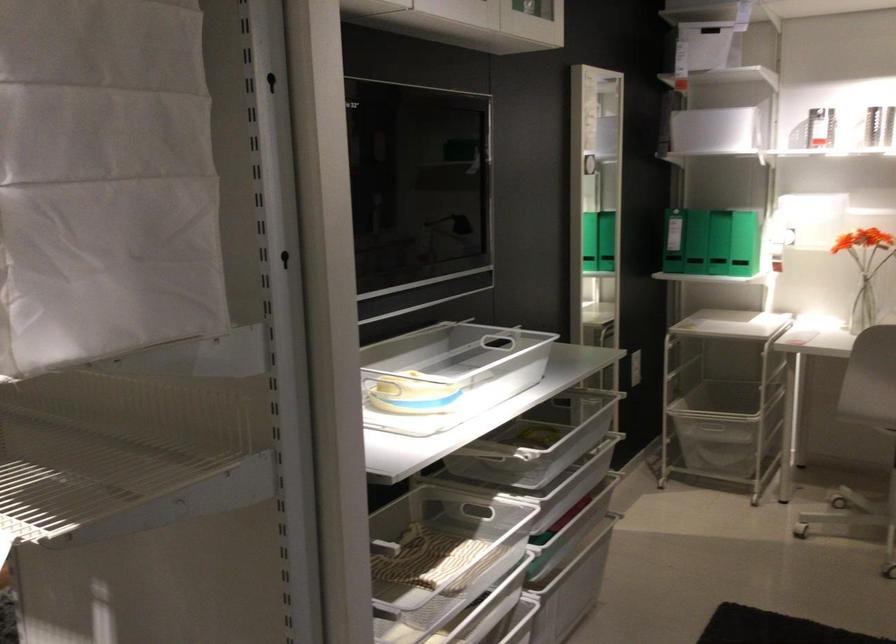
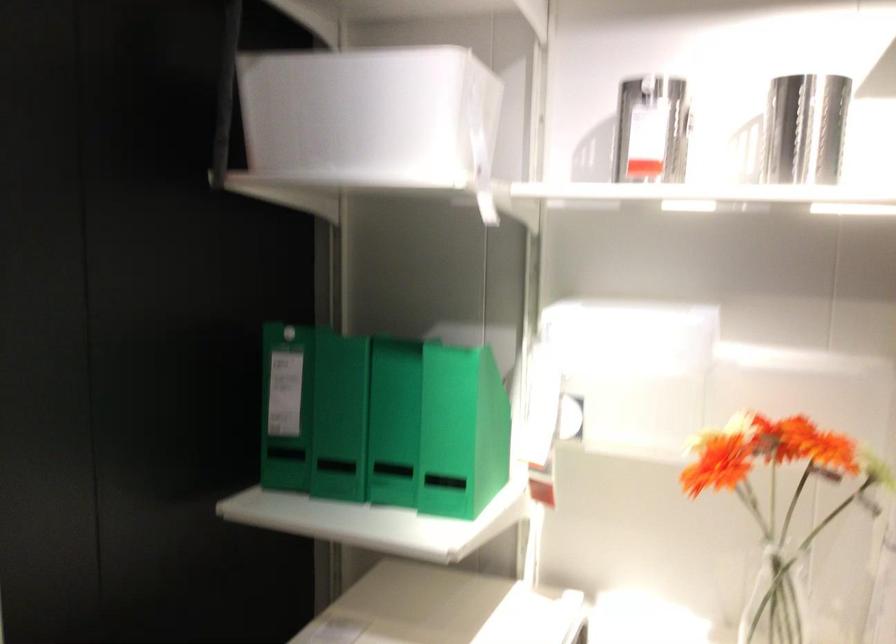
Find the pixel in the second image that matches (x=769, y=228) in the first image.

(461, 431)